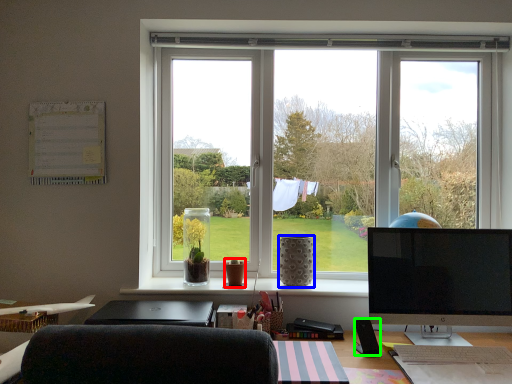
Question: Estimate the real-world distances between objects in this image. Which object is farther from vase (highlighted by a red box), vase (highlighted by a blue box) or loudspeaker (highlighted by a green box)?

Choices:
 (A) vase
 (B) loudspeaker

Answer: (B)